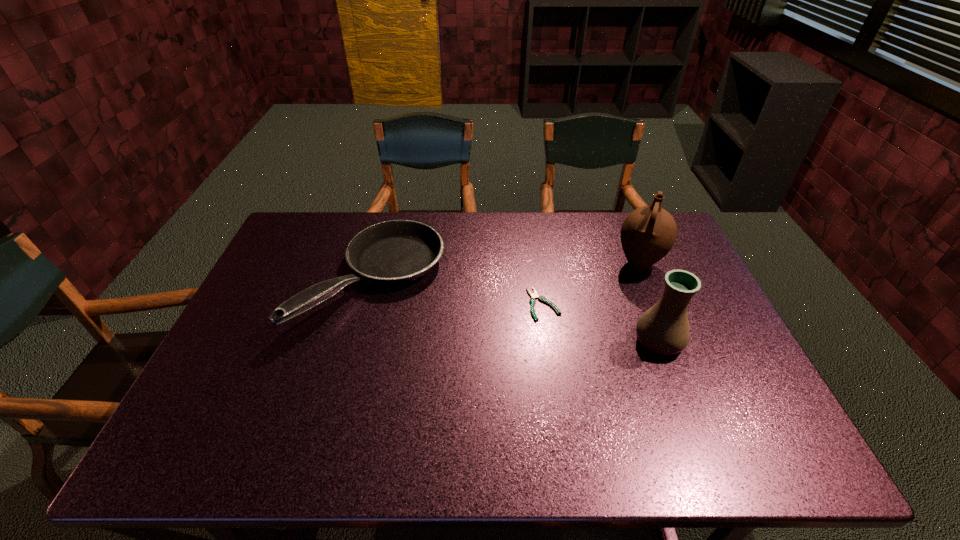
Find the location of a particular element. The width and height of the screenshot is (960, 540). pitcher is located at coordinates (648, 233).

Find the location of a particular element. The image size is (960, 540). the second tallest object is located at coordinates (664, 329).

This screenshot has width=960, height=540. What are the coordinates of `the third tallest object` in the screenshot? It's located at (397, 251).

The width and height of the screenshot is (960, 540). Find the location of `frying pan`. frying pan is located at coordinates (397, 251).

This screenshot has height=540, width=960. I want to click on the second object from left to right, so click(534, 295).

I want to click on pliers, so click(x=534, y=295).

This screenshot has height=540, width=960. I want to click on vacant space located 0.080m on the front of the pitcher, so click(653, 300).

This screenshot has width=960, height=540. In order to click on free region located 0.330m on the left of the third shortest object in this screenshot , I will do `click(509, 341)`.

Where is `vacant space situated 0.190m on the right of the leftmost object`? vacant space situated 0.190m on the right of the leftmost object is located at coordinates (506, 280).

Find the location of a particular element. The image size is (960, 540). vacant space situated 0.330m on the right of the shortest object is located at coordinates (675, 304).